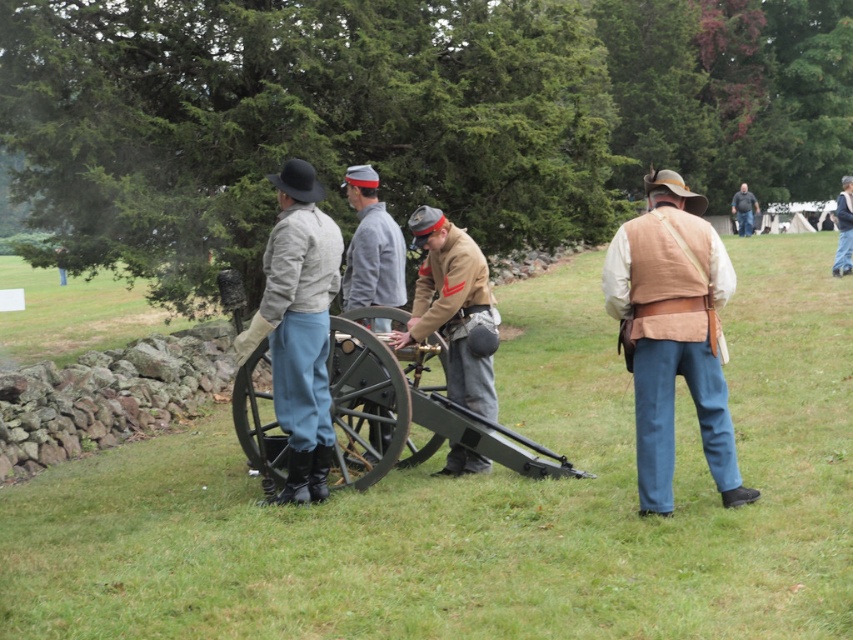
You are a photographer positioned in front of the historical reenactment scene. You want to take a photo focusing on the green matte cannon at center and the brown leather jacket at center. Which object will appear larger in your photo?

The green matte cannon at center will appear larger in the photo because it is closer to the viewer than the brown leather jacket at center.

You are a costume designer observing the historical reenactment scene. You need to determine which item is taller between the green matte cannon at center and the brown leather jacket at center. Which one is taller?

The brown leather jacket at center is taller than the green matte cannon at center according to the description.